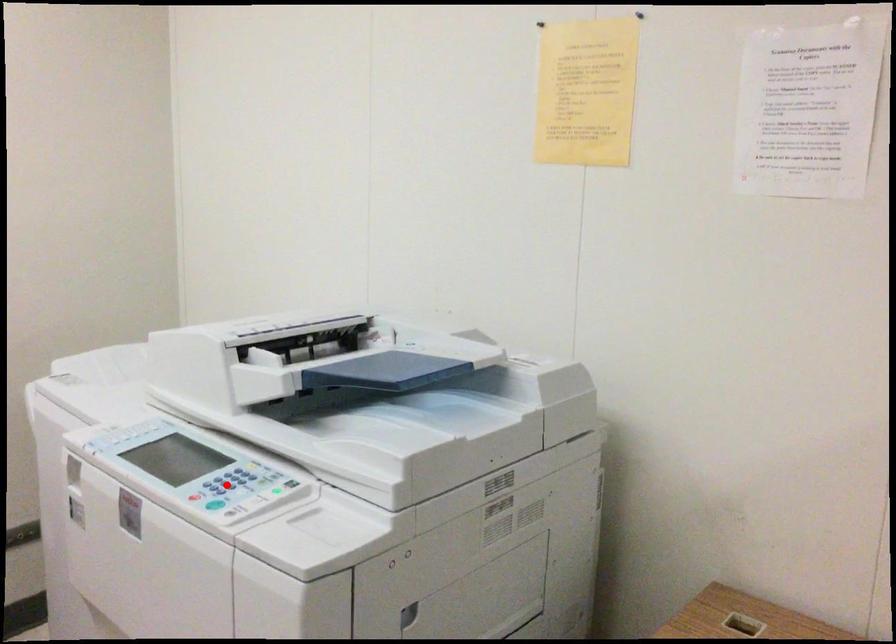
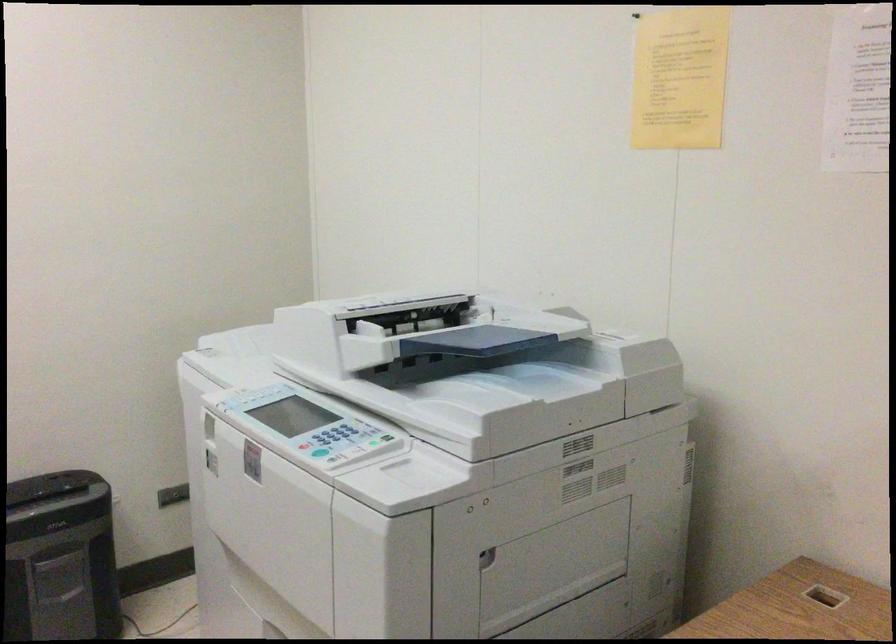
Question: I am providing you with two images of the same scene from different viewpoints. In image1, a red point is highlighted. Considering the same 3D point in image2, which of the following is correct?

Choices:
 (A) It is closer
 (B) It is farther

Answer: (B)